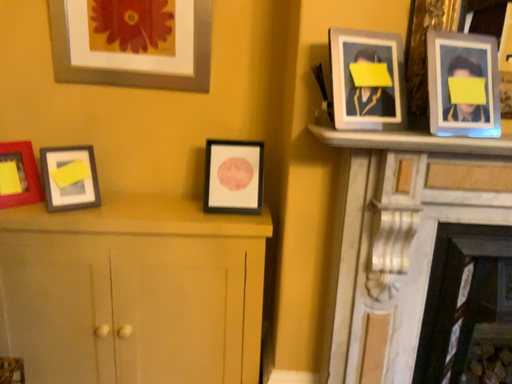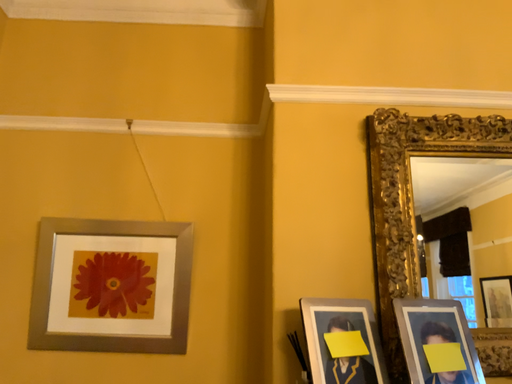
Question: Which way did the camera rotate in the video?

Choices:
 (A) rotated upward
 (B) rotated downward

Answer: (A)